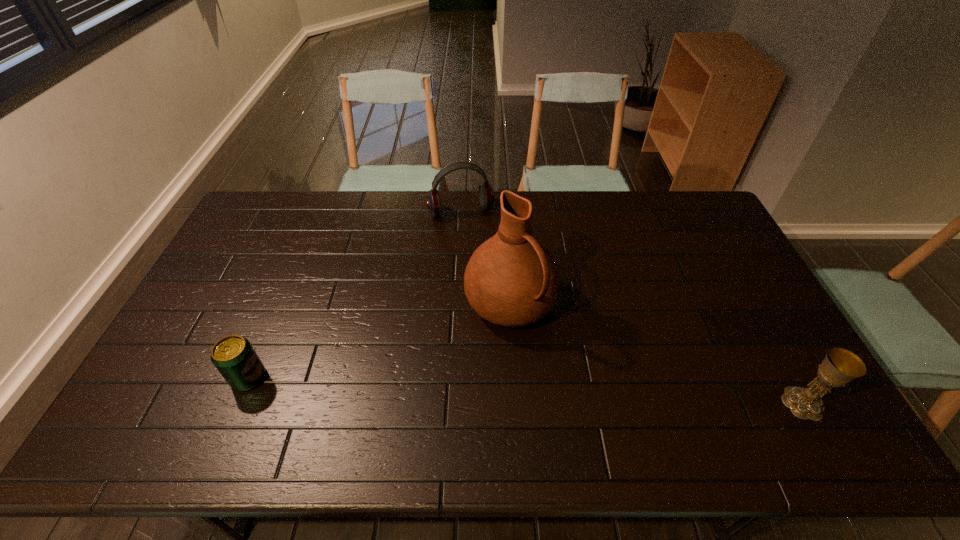
I want to click on vacant spot on the desktop that is between the beer can and the rightmost object and is positioned on the side of the tallest object with the handle, so click(581, 393).

The image size is (960, 540). I want to click on free space on the desktop that is between the shortest object and the rightmost object and is positioned on the ear cups of the earphone, so click(526, 390).